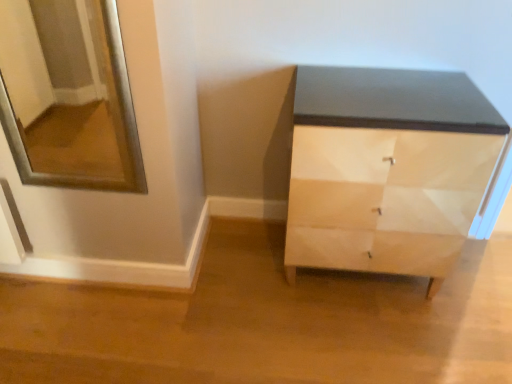
Question: Is matte black cabinet at center to the left of silver/metallic mirror at upper left from the viewer's perspective?

Choices:
 (A) no
 (B) yes

Answer: (A)

Question: Is matte black cabinet at center facing away from silver/metallic mirror at upper left?

Choices:
 (A) yes
 (B) no

Answer: (B)

Question: From the image's perspective, is matte black cabinet at center over silver/metallic mirror at upper left?

Choices:
 (A) yes
 (B) no

Answer: (B)

Question: Does matte black cabinet at center have a larger size compared to silver/metallic mirror at upper left?

Choices:
 (A) no
 (B) yes

Answer: (B)

Question: Does matte black cabinet at center have a greater width compared to silver/metallic mirror at upper left?

Choices:
 (A) yes
 (B) no

Answer: (A)

Question: From a real-world perspective, is matte black cabinet at center over silver/metallic mirror at upper left?

Choices:
 (A) yes
 (B) no

Answer: (B)

Question: Would you say silver/metallic mirror at upper left is a long distance from white glossy drawer at lower right?

Choices:
 (A) yes
 (B) no

Answer: (A)

Question: Considering the relative sizes of silver/metallic mirror at upper left and white glossy drawer at lower right in the image provided, is silver/metallic mirror at upper left taller than white glossy drawer at lower right?

Choices:
 (A) no
 (B) yes

Answer: (B)

Question: Can you confirm if silver/metallic mirror at upper left is shorter than white glossy drawer at lower right?

Choices:
 (A) yes
 (B) no

Answer: (B)

Question: Can you confirm if silver/metallic mirror at upper left is wider than white glossy drawer at lower right?

Choices:
 (A) yes
 (B) no

Answer: (A)

Question: Does silver/metallic mirror at upper left have a lesser width compared to white glossy drawer at lower right?

Choices:
 (A) no
 (B) yes

Answer: (A)

Question: Is the depth of silver/metallic mirror at upper left greater than that of white glossy drawer at lower right?

Choices:
 (A) no
 (B) yes

Answer: (A)

Question: Is white glossy drawer at lower right taller than matte black cabinet at center?

Choices:
 (A) no
 (B) yes

Answer: (A)